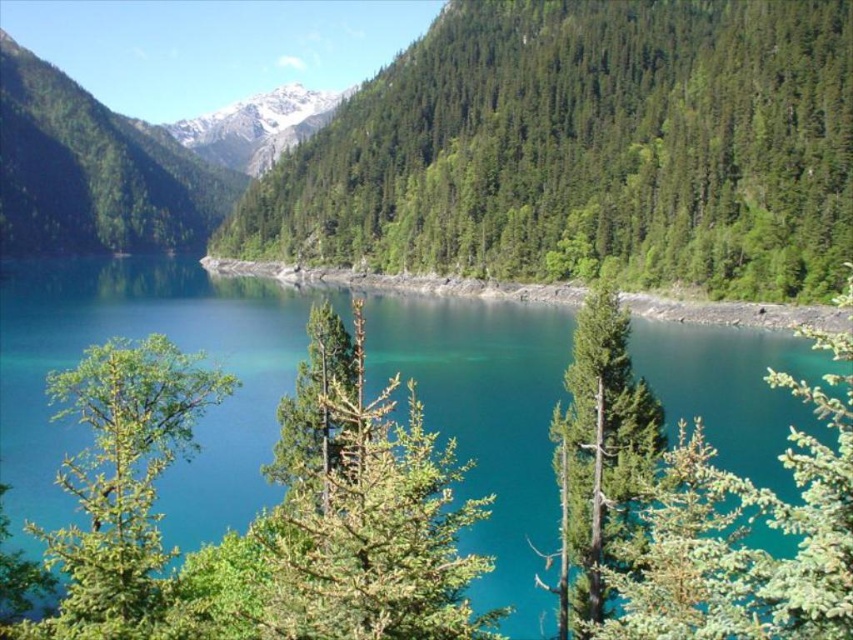
Question: Estimate the real-world distances between objects in this image. Which object is farther from the teal glossy water at center?

Choices:
 (A) green matte tree at left
 (B) green textured tree at center
 (C) green matte tree at center
 (D) green needle-like tree at center

Answer: (B)

Question: Where is green textured tree at center located in relation to white snow-covered mountain at upper center in the image?

Choices:
 (A) above
 (B) below

Answer: (B)

Question: Does green textured tree at center have a lesser width compared to green needle-like tree at center?

Choices:
 (A) yes
 (B) no

Answer: (B)

Question: Which object appears farthest from the camera in this image?

Choices:
 (A) green matte tree at center
 (B) green textured tree at center

Answer: (B)

Question: Can you confirm if green textured tree at center is bigger than teal glossy water at center?

Choices:
 (A) yes
 (B) no

Answer: (B)

Question: Which is nearer to the green matte tree at left?

Choices:
 (A) green needle-like tree at center
 (B) teal glossy water at center

Answer: (A)